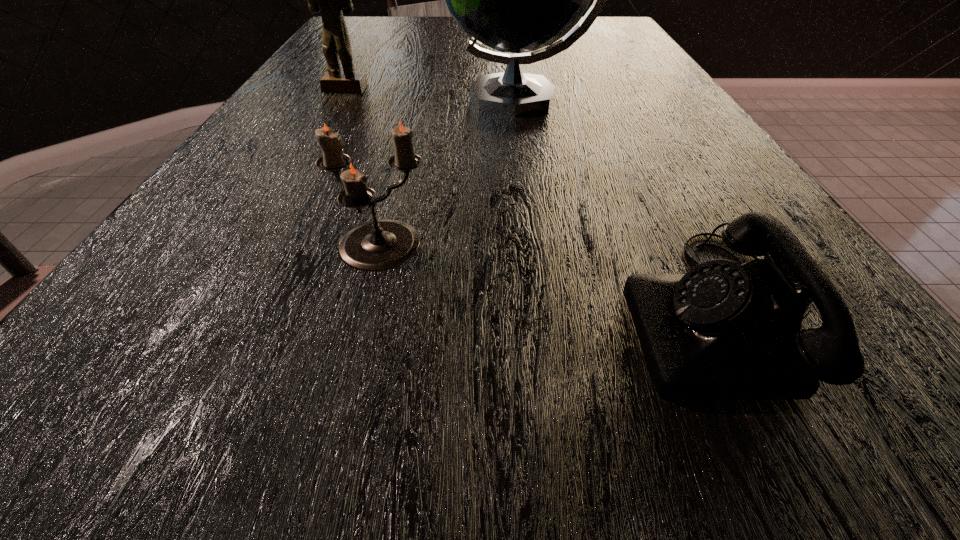
You are a GUI agent. You are given a task and a screenshot of the screen. Output one action in this format:
    pyautogui.click(x=<x>, y=<y>)
    Task: Click on the free space between the shortest object and the candle holder
    
    Given the screenshot: What is the action you would take?
    pyautogui.click(x=551, y=280)

You are a GUI agent. You are given a task and a screenshot of the screen. Output one action in this format:
    pyautogui.click(x=<x>, y=<y>)
    Task: Click on the vacant area that lies between the shortest object and the tallest object
    The width and height of the screenshot is (960, 540).
    Given the screenshot: What is the action you would take?
    pyautogui.click(x=621, y=205)

You are a GUI agent. You are given a task and a screenshot of the screen. Output one action in this format:
    pyautogui.click(x=<x>, y=<y>)
    Task: Click on the object that is the third closest to the third tallest object
    
    Given the screenshot: What is the action you would take?
    pyautogui.click(x=330, y=0)

At what (x,y) coordinates should I click in order to perform the action: click on object identified as the closest to the candle holder. Please return your answer as a coordinate pair (x, y). Looking at the image, I should click on (723, 331).

The image size is (960, 540). Identify the location of vacant area that satisfies the following two spatial constraints: 1. on the front-facing side of the candle holder; 2. on the right side of the leftmost object. (257, 248).

At what (x,y) coordinates should I click in order to perform the action: click on free space that satisfies the following two spatial constraints: 1. on the front-facing side of the candle holder; 2. on the right side of the third shortest object. Please return your answer as a coordinate pair (x, y). Looking at the image, I should click on (257, 248).

Identify the location of vacant space that satisfies the following two spatial constraints: 1. on the front surface of the globe; 2. on the front side of the candle holder. The image size is (960, 540). (542, 248).

In order to click on vacant region that satisfies the following two spatial constraints: 1. on the front-facing side of the candle holder; 2. on the left side of the leftmost object in this screenshot , I will do `click(257, 248)`.

You are a GUI agent. You are given a task and a screenshot of the screen. Output one action in this format:
    pyautogui.click(x=<x>, y=<y>)
    Task: Click on the vacant space that satisfies the following two spatial constraints: 1. on the front-facing side of the candle holder; 2. on the left side of the figurine
    This screenshot has width=960, height=540.
    Given the screenshot: What is the action you would take?
    pyautogui.click(x=257, y=248)